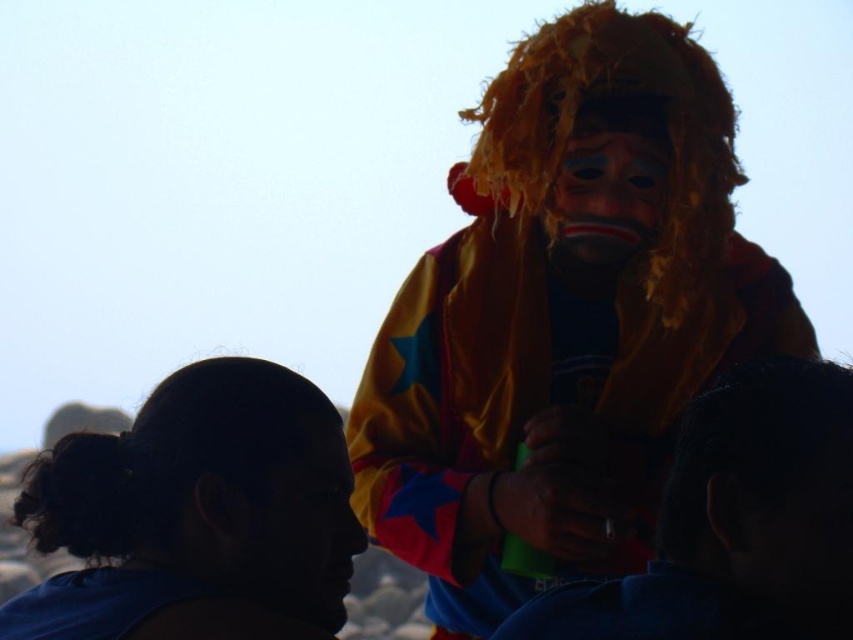
Question: Can you confirm if silky fabric shirt at center is positioned above matte black face at center?

Choices:
 (A) no
 (B) yes

Answer: (A)

Question: Which of these objects is positioned closest to the matte black face at center?

Choices:
 (A) blue fabric head at lower left
 (B) yellow fabric lion mask at upper right

Answer: (A)

Question: Considering the real-world distances, which object is farthest from the silky fabric shirt at center?

Choices:
 (A) blue fabric head at lower left
 (B) yellow fabric lion mask at upper right

Answer: (B)

Question: Does silky fabric shirt at center appear on the left side of matte plastic mask at center?

Choices:
 (A) yes
 (B) no

Answer: (B)

Question: Is the position of yellow fabric lion mask at upper right less distant than that of matte plastic mask at center?

Choices:
 (A) no
 (B) yes

Answer: (B)

Question: Which object appears farthest from the camera in this image?

Choices:
 (A) matte plastic mask at center
 (B) blue fabric head at lower left
 (C) yellow fabric lion mask at upper right
 (D) matte black face at center

Answer: (A)